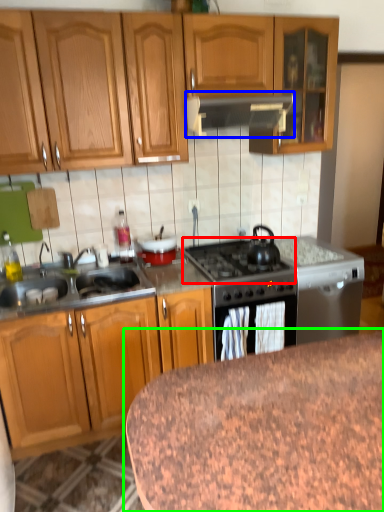
Question: Which is farther away from gas stove (highlighted by a red box)? kitchen appliance (highlighted by a blue box) or table (highlighted by a green box)?

Choices:
 (A) kitchen appliance
 (B) table

Answer: (B)